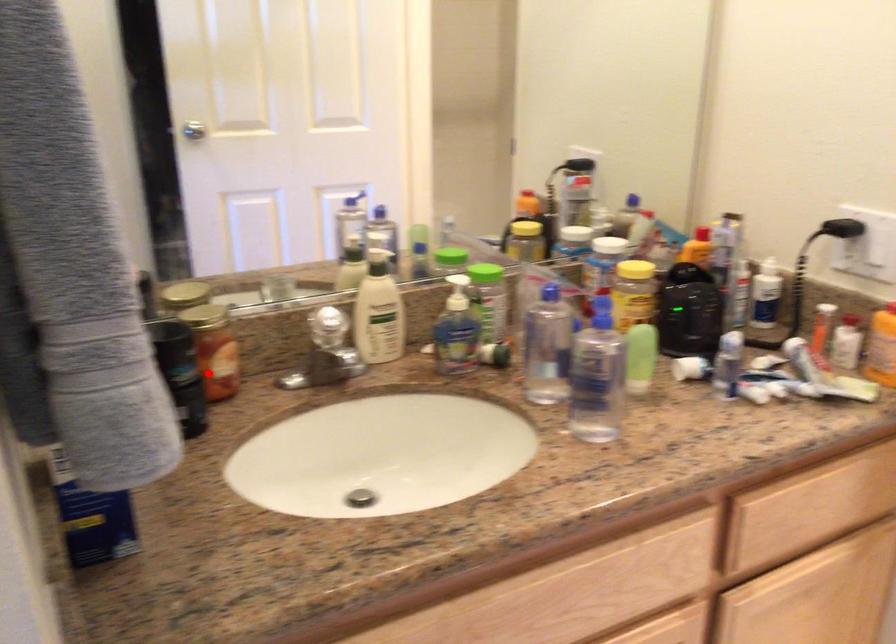
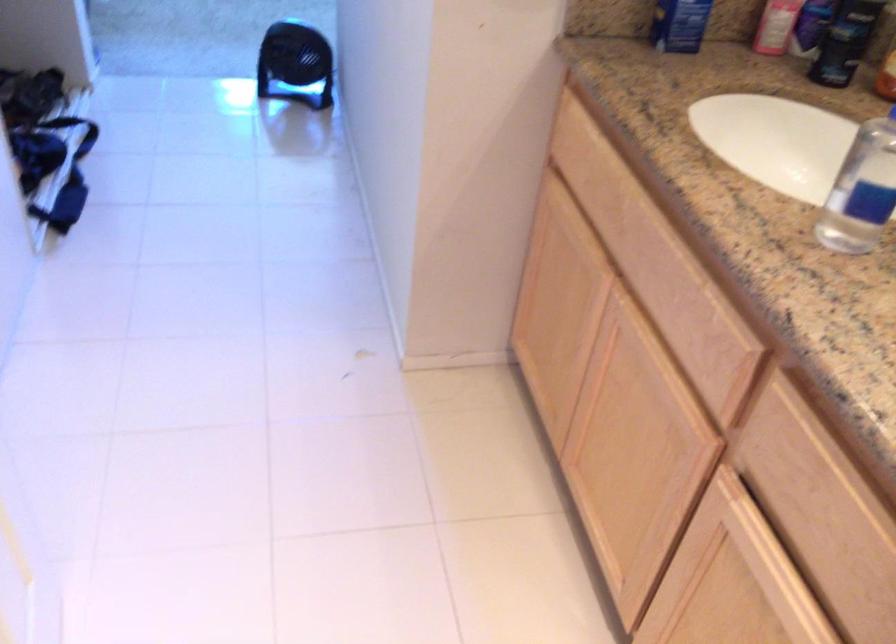
Question: I am providing you with two images of the same scene from different viewpoints. In image1, a red point is highlighted. Considering the same 3D point in image2, which of the following is correct?

Choices:
 (A) It is closer
 (B) It is farther

Answer: (B)